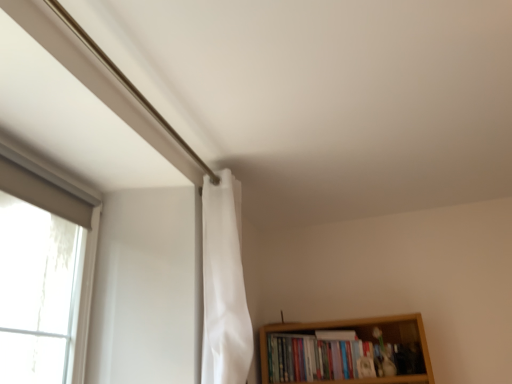
Question: From the image's perspective, is hardcover books at lower right positioned above or below white fabric shower curtain at upper center?

Choices:
 (A) above
 (B) below

Answer: (B)

Question: Considering the positions of point (394, 370) and point (225, 241), is point (394, 370) closer or farther from the camera than point (225, 241)?

Choices:
 (A) closer
 (B) farther

Answer: (B)

Question: In the image, is hardcover books at lower right positioned in front of or behind white fabric shower curtain at upper center?

Choices:
 (A) behind
 (B) front

Answer: (A)

Question: Would you say white fabric shower curtain at upper center is inside or outside hardcover books at lower right?

Choices:
 (A) outside
 (B) inside

Answer: (A)

Question: Is white fabric shower curtain at upper center in front of or behind hardcover books at lower right in the image?

Choices:
 (A) front
 (B) behind

Answer: (A)

Question: From a real-world perspective, is white fabric shower curtain at upper center positioned above or below hardcover books at lower right?

Choices:
 (A) above
 (B) below

Answer: (A)

Question: From the image's perspective, is white fabric shower curtain at upper center located above or below hardcover books at lower right?

Choices:
 (A) below
 (B) above

Answer: (B)